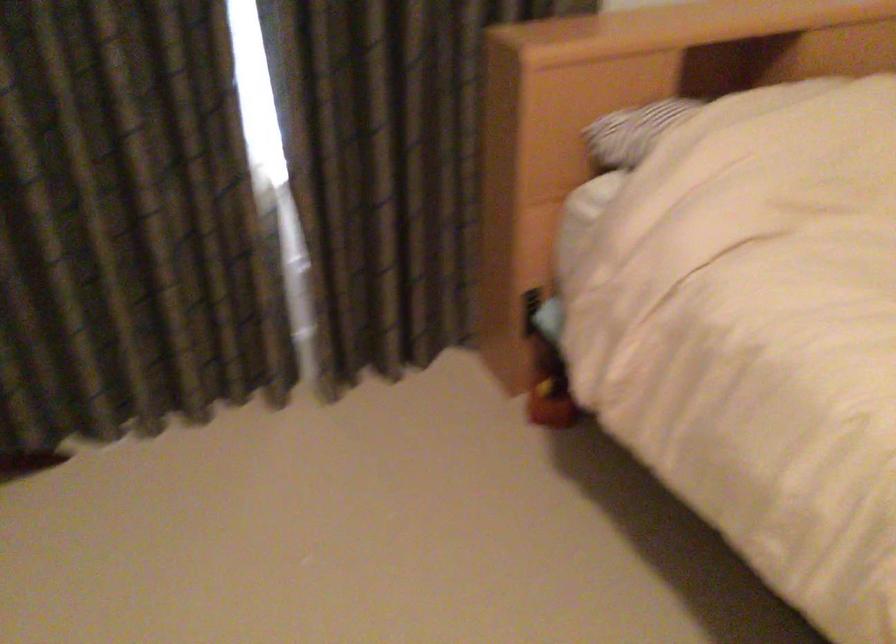
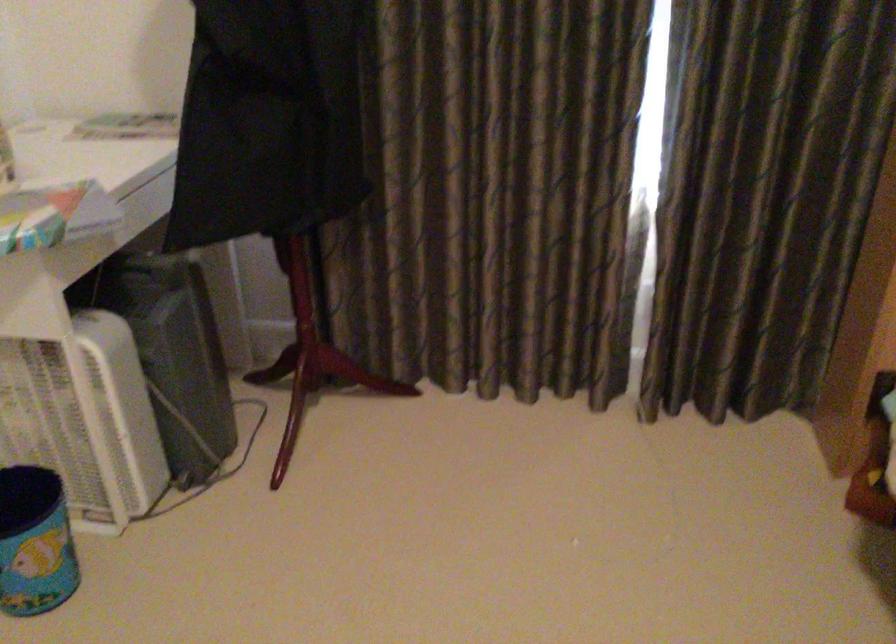
Where in the second image is the point corresponding to the point at 497,228 from the first image?

(865, 298)